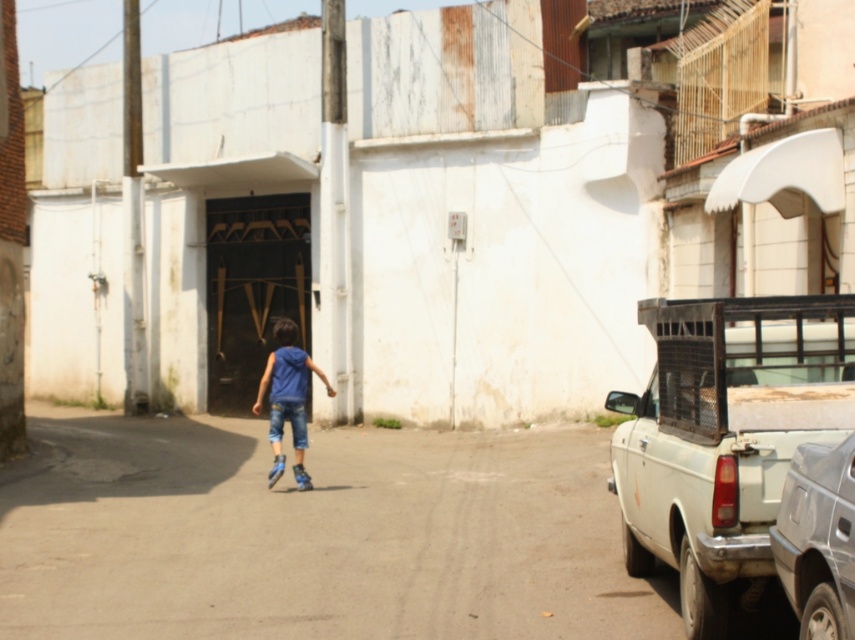
What is the position of the silver metallic car at right in the image?

The silver metallic car at right is located at point (818, 538).

The image shows a child rollerblading towards a building with a garage door. There is a point marked at coordinates (818, 538). What object is located at that point?

The point at coordinates (818, 538) indicates a silver metallic car at right.